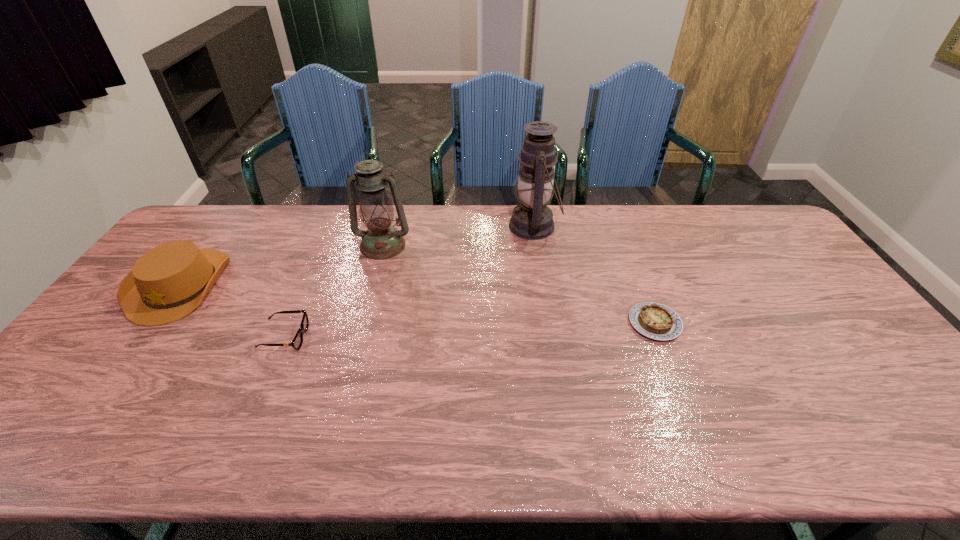
Identify the location of free region that satisfies the following two spatial constraints: 1. on the back side of the fourth object from left to right; 2. on the right side of the fourth shortest object. click(388, 226).

Identify the location of vacant space that satisfies the following two spatial constraints: 1. on the front side of the fourth object from left to right; 2. on the front-facing side of the fourth tallest object. (552, 337).